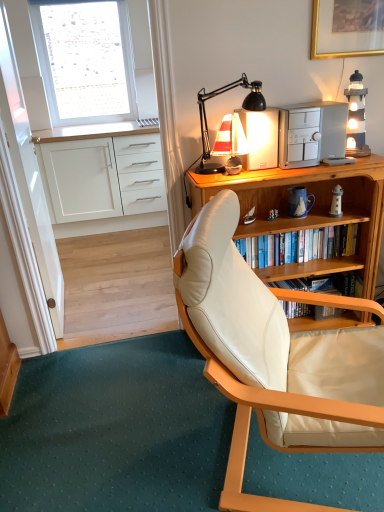
You are a GUI agent. You are given a task and a screenshot of the screen. Output one action in this format:
    pyautogui.click(x=<x>, y=<y>)
    Task: Click on the blank space to the left of beige leather chair at center
    
    Given the screenshot: What is the action you would take?
    pyautogui.click(x=137, y=437)